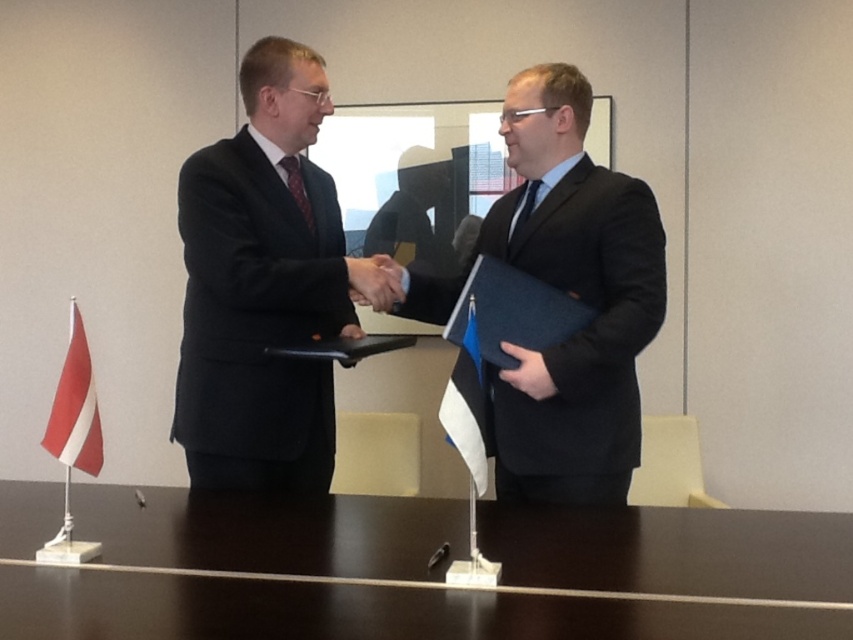
You are an observer in the scene. You notice the matte black suit at center and the black fabric hand at center. Which object is covering the other?

The matte black suit at center is positioned over the black fabric hand at center, so the matte black suit at center is covering it.

You are standing in the office and need to place a document on the dark wood table at center. From your current position facing the matte black suit at center, should you move to your left or right to reach the table?

The dark wood table at center is to the right of the matte black suit at center, so you should move to your right to reach it.

You are a photographer setting up for a professional photo shoot in the described scene. You need to position a small lamp on the dark wood table at center so that it doesn not block the black fabric hand at center during the shot. Where should you place the lamp?

The dark wood table at center is below the black fabric hand at center, so placing the lamp on the table away from the area directly under the hand will ensure it doesn not obstruct the view of the hand.